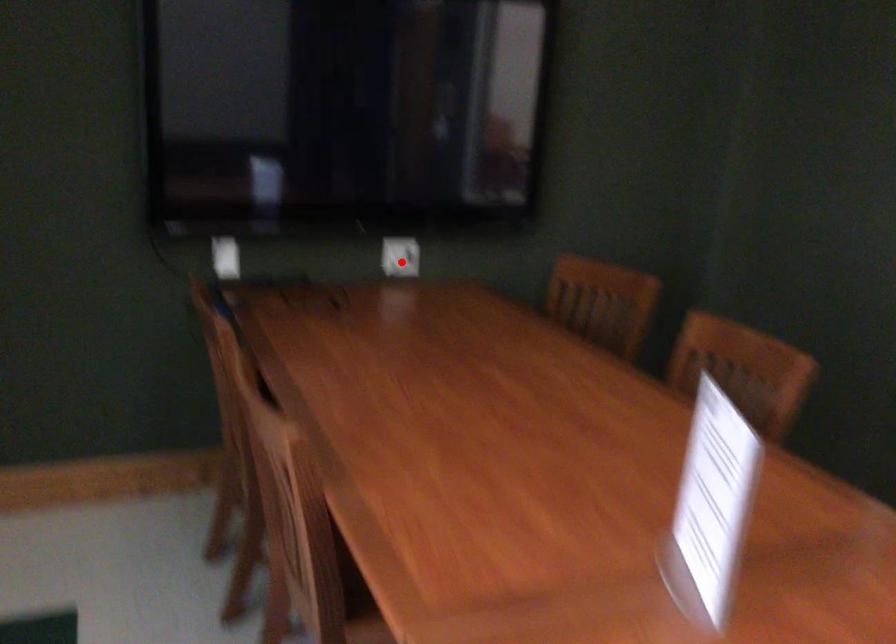
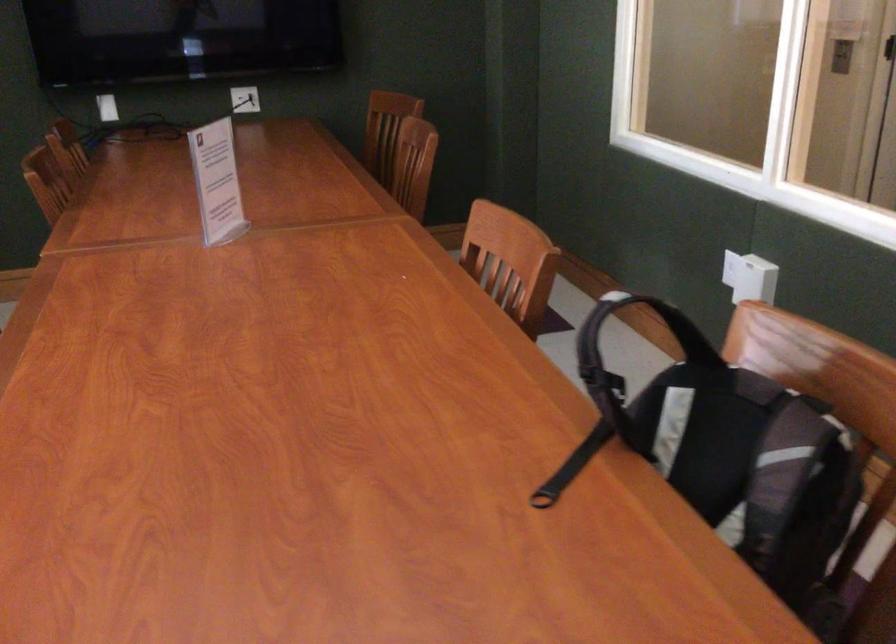
In the second image, find the point that corresponds to the highlighted location in the first image.

(245, 99)